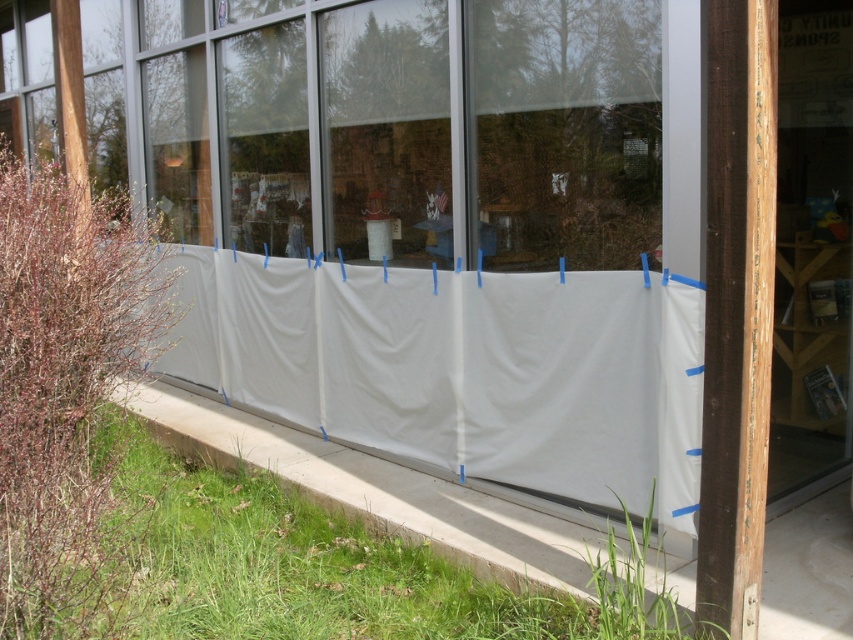
Does white fabric curtain at lower center appear over white fabric screen door at right?

No.

Is point (276, 344) more distant than point (808, 250)?

Yes, it is behind point (808, 250).

The width and height of the screenshot is (853, 640). Find the location of `white fabric curtain at lower center`. white fabric curtain at lower center is located at coordinates (463, 369).

How distant is transparent plastic sheet at center from white fabric curtain at lower center?

transparent plastic sheet at center and white fabric curtain at lower center are 6.34 feet apart from each other.

Describe the element at coordinates (404, 125) in the screenshot. Image resolution: width=853 pixels, height=640 pixels. I see `transparent plastic sheet at center` at that location.

Find the location of a particular element. transparent plastic sheet at center is located at coordinates (404, 125).

Find the location of a particular element. This screenshot has width=853, height=640. transparent plastic sheet at center is located at coordinates (404, 125).

Is transparent plastic sheet at center shorter than white fabric screen door at right?

Indeed, transparent plastic sheet at center has a lesser height compared to white fabric screen door at right.

Between transparent plastic sheet at center and white fabric screen door at right, which one is positioned higher?

transparent plastic sheet at center is higher up.

Image resolution: width=853 pixels, height=640 pixels. I want to click on transparent plastic sheet at center, so click(404, 125).